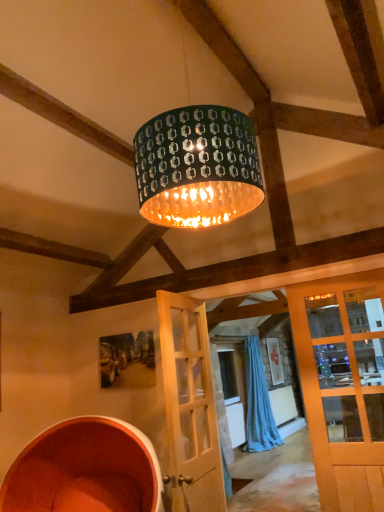
Question: Is blue fabric curtain at center facing away from light wood door at center?

Choices:
 (A) yes
 (B) no

Answer: (B)

Question: Considering the relative sizes of blue fabric curtain at center and light wood door at center in the image provided, is blue fabric curtain at center bigger than light wood door at center?

Choices:
 (A) no
 (B) yes

Answer: (B)

Question: Does blue fabric curtain at center have a greater height compared to light wood door at center?

Choices:
 (A) no
 (B) yes

Answer: (B)

Question: Is blue fabric curtain at center at the left side of light wood door at center?

Choices:
 (A) yes
 (B) no

Answer: (B)

Question: Is light wood door at center located within blue fabric curtain at center?

Choices:
 (A) yes
 (B) no

Answer: (B)

Question: Is blue fabric curtain at center thinner than light wood door at center?

Choices:
 (A) yes
 (B) no

Answer: (B)

Question: Is green metallic drum at center looking in the opposite direction of blue fabric curtain at center?

Choices:
 (A) no
 (B) yes

Answer: (A)

Question: From the image's perspective, does green metallic drum at center appear higher than blue fabric curtain at center?

Choices:
 (A) no
 (B) yes

Answer: (B)

Question: Does green metallic drum at center appear on the left side of blue fabric curtain at center?

Choices:
 (A) yes
 (B) no

Answer: (A)

Question: Considering the relative positions of green metallic drum at center and blue fabric curtain at center in the image provided, is green metallic drum at center behind blue fabric curtain at center?

Choices:
 (A) no
 (B) yes

Answer: (A)

Question: Can you confirm if green metallic drum at center is wider than blue fabric curtain at center?

Choices:
 (A) yes
 (B) no

Answer: (A)

Question: Is green metallic drum at center surrounding blue fabric curtain at center?

Choices:
 (A) yes
 (B) no

Answer: (B)

Question: Is there a large distance between green metallic drum at center and light wood door at center?

Choices:
 (A) yes
 (B) no

Answer: (A)